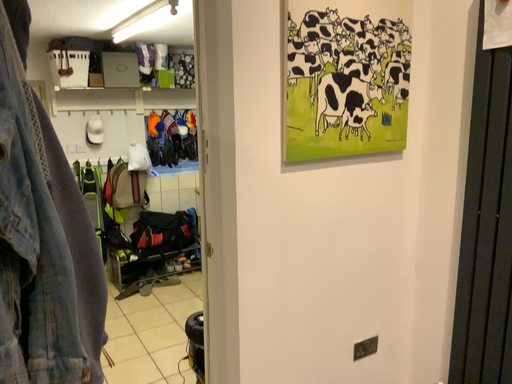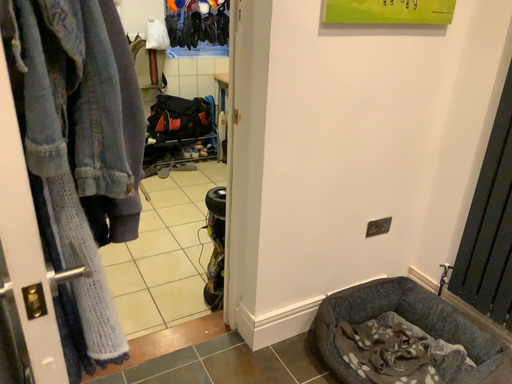
Question: Which way did the camera rotate in the video?

Choices:
 (A) rotated downward
 (B) rotated upward

Answer: (A)